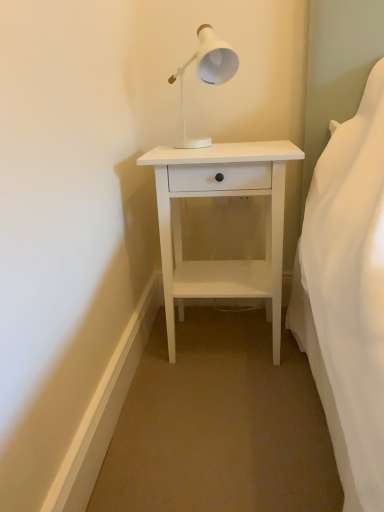
You are a GUI agent. You are given a task and a screenshot of the screen. Output one action in this format:
    pyautogui.click(x=<x>, y=<y>)
    Task: Click on the free space above white matte nightstand at center (from a real-world perspective)
    Image resolution: width=384 pixels, height=512 pixels.
    Given the screenshot: What is the action you would take?
    pyautogui.click(x=223, y=146)